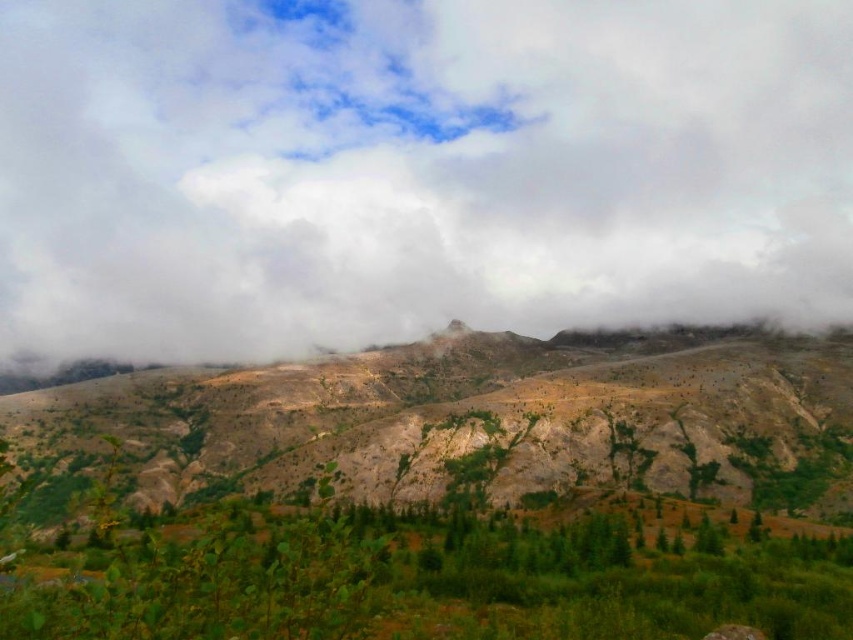
Does white fluffy cloud at upper center lie in front of rugged stone mountain at center?

No, it is behind rugged stone mountain at center.

Between white fluffy cloud at upper center and rugged stone mountain at center, which one has less height?

Standing shorter between the two is rugged stone mountain at center.

Where is `white fluffy cloud at upper center`? This screenshot has height=640, width=853. white fluffy cloud at upper center is located at coordinates (415, 170).